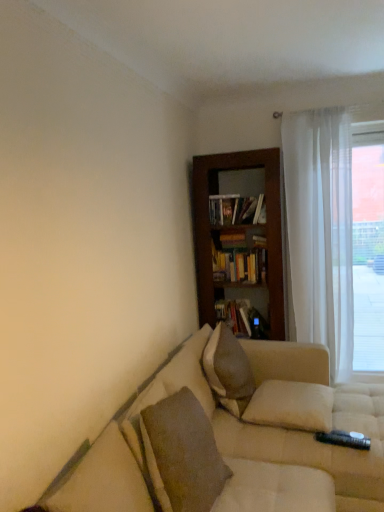
Question: From a real-world perspective, is white soft pillow at center, the 2th pillow when ordered from front to back, positioned above or below wooden bookshelf at center?

Choices:
 (A) above
 (B) below

Answer: (B)

Question: Would you say white soft pillow at center, the 2th pillow when ordered from front to back, is to the left or to the right of wooden bookshelf at center in the picture?

Choices:
 (A) left
 (B) right

Answer: (B)

Question: Estimate the real-world distances between objects in this image. Which object is closer to the beige fabric couch at lower right?

Choices:
 (A) textured beige pillow at lower left, arranged as the third pillow when viewed from the back
 (B) textured beige pillow at center, the first pillow from the back
 (C) hardcover books at center, which appears as the first book when viewed from the top
 (D) white soft pillow at center, the 2th pillow when ordered from front to back
 (E) white sheer curtain at right

Answer: (D)

Question: Considering the real-world distances, which object is closest to the wooden bookshelf at center?

Choices:
 (A) transparent curtain at right
 (B) hardcover book at center, the second book in the top-to-bottom sequence
 (C) textured beige pillow at center, which is counted as the third pillow, starting from the front
 (D) textured beige pillow at lower left, the 1th pillow positioned from the front
 (E) white sheer curtain at right

Answer: (E)